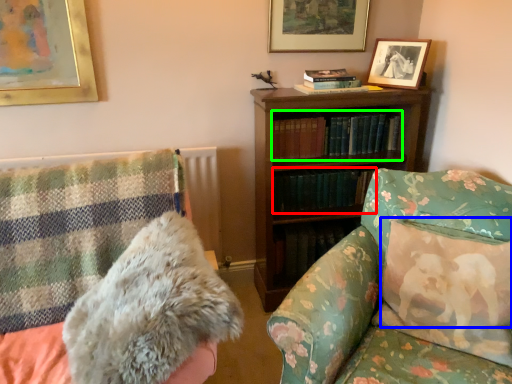
Question: Based on their relative distances, which object is nearer to book (highlighted by a red box)? Choose from pillow (highlighted by a blue box) and book (highlighted by a green box).

Choices:
 (A) pillow
 (B) book

Answer: (B)